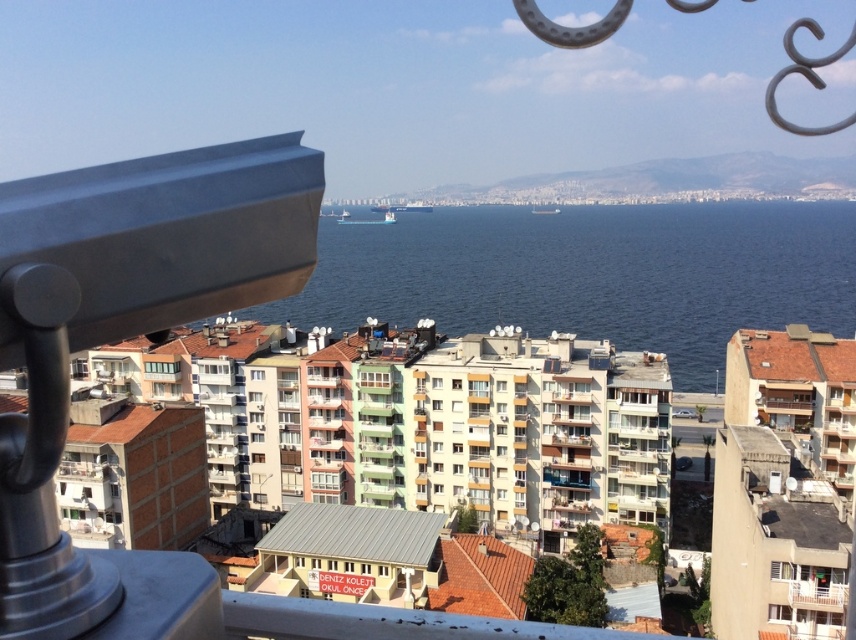
You are an astronomer visiting this coastal city and want to observe the stars using the metallic gray telescope at left. However, you notice the blue water at center might interfere with your view. Can you determine if the telescope is tall enough to avoid the water obstruction?

The metallic gray telescope at left is shorter than blue water at center, so it may not be tall enough to avoid the water obstruction and could be blocked by the water.

You are standing on a balcony overlooking the city and want to take a photo. There are two points of interest marked as point 1 at coordinates (x=55, y=632) and point 2 at coordinates (x=417, y=216). Which point will appear closer to you in the photo?

Point 1 at coordinates (x=55, y=632) will appear closer to you in the photo because it is in front of point 2 at coordinates (x=417, y=216).